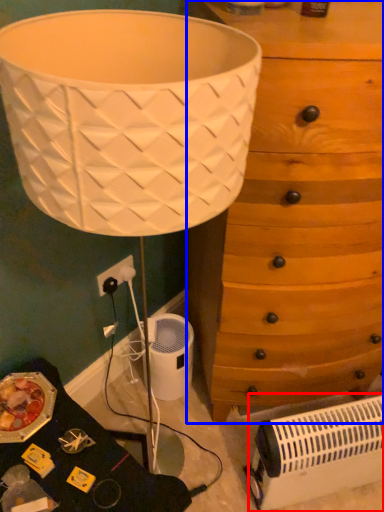
Question: Which of the following is the farthest to the observer, heater (highlighted by a red box) or chest of drawers (highlighted by a blue box)?

Choices:
 (A) heater
 (B) chest of drawers

Answer: (A)